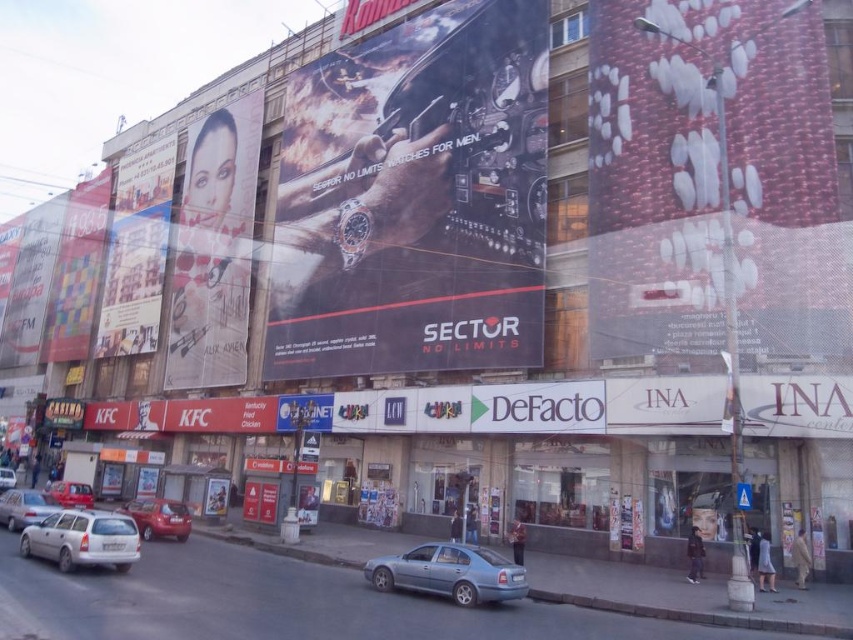
Measure the distance between metallic watch at center and camera.

metallic watch at center is 173.23 feet from camera.

In order to click on metallic watch at center in this screenshot , I will do `click(415, 198)`.

Who is more distant from viewer, (657, 204) or (82, 314)?

Positioned behind is point (82, 314).

Does point (701, 10) come farther from viewer compared to point (57, 276)?

No, (701, 10) is in front of (57, 276).

Which is behind, point (607, 145) or point (97, 193)?

The point (97, 193) is behind.

The width and height of the screenshot is (853, 640). I want to click on textured red fabric at upper right, so click(x=712, y=182).

Where is `metallic silver sedan at lower left`? metallic silver sedan at lower left is located at coordinates 158,516.

Does metallic silver sedan at lower left appear over silver metallic car at center?

Yes, metallic silver sedan at lower left is above silver metallic car at center.

What do you see at coordinates (158, 516) in the screenshot? The height and width of the screenshot is (640, 853). I see `metallic silver sedan at lower left` at bounding box center [158, 516].

Locate an element on the screen. metallic silver sedan at lower left is located at coordinates (158, 516).